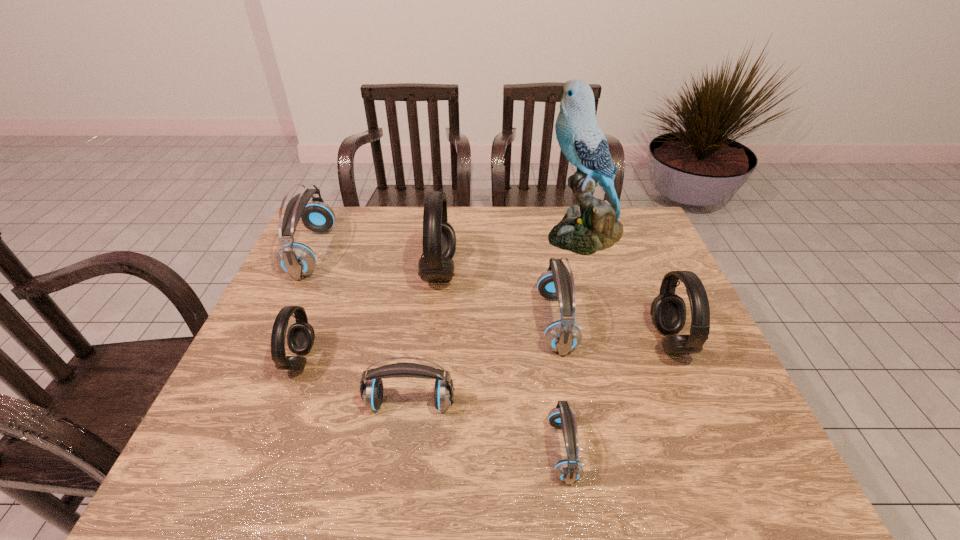
Identify the location of free space located on the earcups of the rightmost headset. (540, 341).

The image size is (960, 540). Find the location of `free space located 0.340m on the ear cups of the second biggest blue headset`. free space located 0.340m on the ear cups of the second biggest blue headset is located at coordinates (412, 322).

Identify the location of vacant region located on the ear cups of the second biggest blue headset. (494, 322).

At what (x,y) coordinates should I click in order to perform the action: click on free region located on the ear cups of the second biggest blue headset. Please return your answer as a coordinate pair (x, y). This screenshot has height=540, width=960. Looking at the image, I should click on (423, 322).

Find the location of a particular element. blank area located 0.190m on the earcups of the second object from left to right is located at coordinates (390, 360).

Where is `free space located on the ear cups of the third blue headset from right to left`? free space located on the ear cups of the third blue headset from right to left is located at coordinates click(x=400, y=471).

This screenshot has width=960, height=540. In order to click on free region located on the ear cups of the shortest headset in this screenshot , I will do `click(487, 450)`.

Where is `vacant region located 0.210m on the ear cups of the shortest headset`? The height and width of the screenshot is (540, 960). vacant region located 0.210m on the ear cups of the shortest headset is located at coordinates (448, 450).

Locate an element on the screen. free space located on the ear cups of the shortest headset is located at coordinates (453, 450).

Identify the location of parakeet located at the far edge. (596, 227).